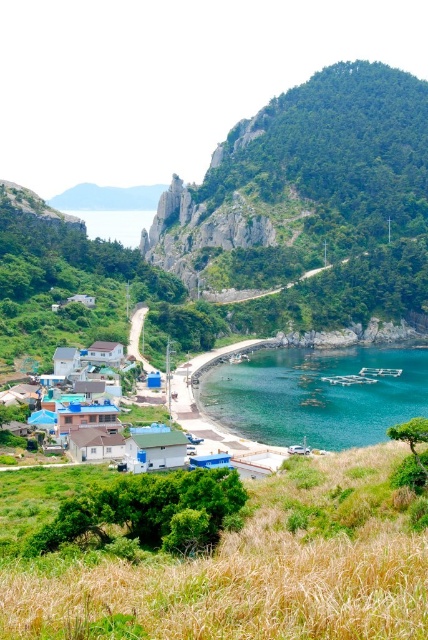
Question: Among these objects, which one is nearest to the camera?

Choices:
 (A) blue matte hut at center
 (B) clear blue water at lower center
 (C) white matte house at lower left

Answer: (A)

Question: Considering the real-world distances, which object is farthest from the green grassy mountain at upper center?

Choices:
 (A) transparent blue water at upper center
 (B) white matte house at center
 (C) matte gray hut at center

Answer: (C)

Question: Is white matte hut at center positioned before transparent blue water at upper center?

Choices:
 (A) yes
 (B) no

Answer: (A)

Question: Which point is farther from the camera taking this photo?

Choices:
 (A) (172, 198)
 (B) (216, 465)
 (C) (67, 364)
 (D) (395, 406)

Answer: (A)

Question: Is green leafy mountain at upper center wider than matte gray hut at center?

Choices:
 (A) yes
 (B) no

Answer: (A)

Question: Does green leafy mountain at upper center come behind white matte house at center?

Choices:
 (A) no
 (B) yes

Answer: (B)